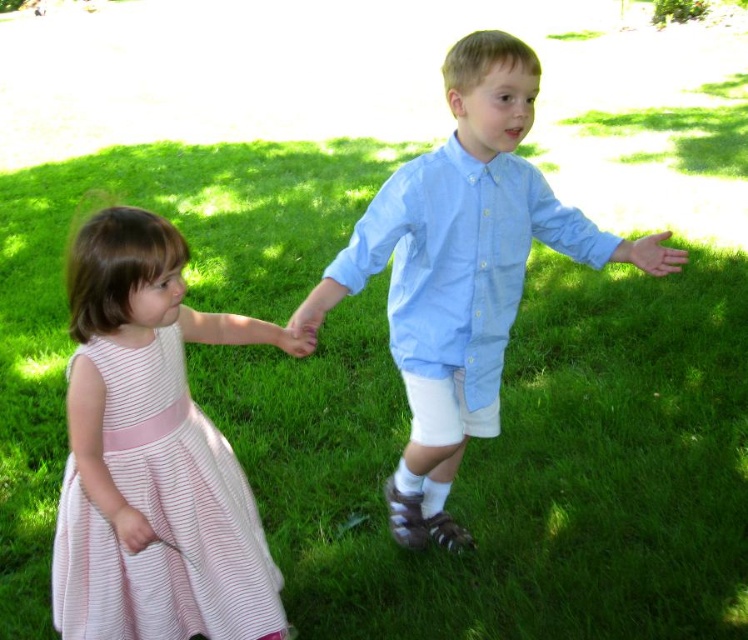
You are standing in a park and see a child wearing a light blue cotton shirt at center. If you want to throw a ball to them, will it take more than two seconds for the ball to reach them?

The light blue cotton shirt at center is 2.11 meters away. Assuming a typical throwing speed of about 15 meters per second, the time taken would be approximately 0.14 seconds, which is less than two seconds. Therefore, the ball would reach them in under two seconds.

You are a photographer trying to capture a photo of the two children. You want to ensure both the light blue cotton shirt at center and the pink striped fabric dress at left are clearly visible. Based on their positions, which child should you focus on first to ensure both are in frame?

Since the light blue cotton shirt at center is to the right of the pink striped fabric dress at left, you should focus on the pink striped fabric dress at left first to ensure both are in frame as they are positioned side by side from left to right.

Based on the scene description, which child is taller between the light blue cotton shirt at center and the pink striped fabric dress at left?

The light blue cotton shirt at center is much taller than the pink striped fabric dress at left.